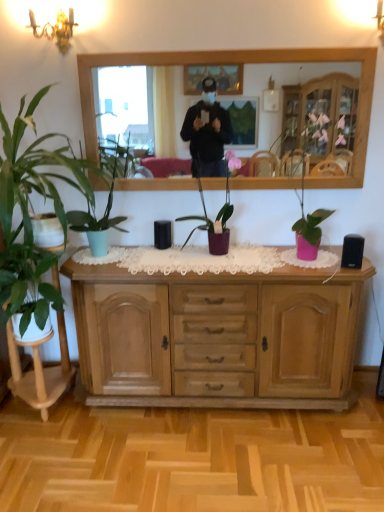
At what (x,y) coordinates should I click in order to perform the action: click on free space in front of light brown wood cabinet at center. Please return your answer as a coordinate pair (x, y). The width and height of the screenshot is (384, 512). Looking at the image, I should click on (226, 457).